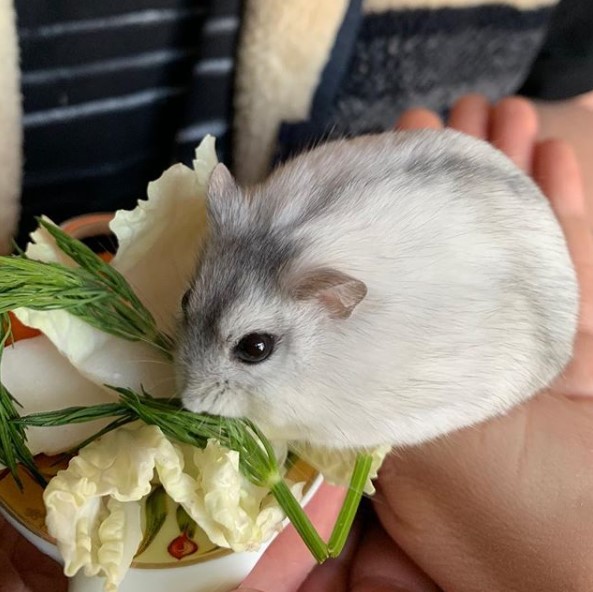
Locate an element on the screen. bowl is located at coordinates (174, 575).